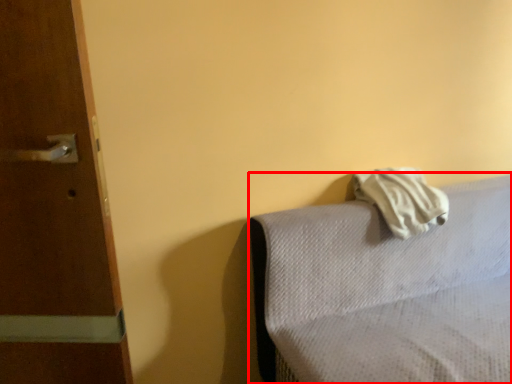
Question: Observing the image, what is the correct spatial positioning of furniture (annotated by the red box) in reference to bath towel?

Choices:
 (A) left
 (B) right

Answer: (B)